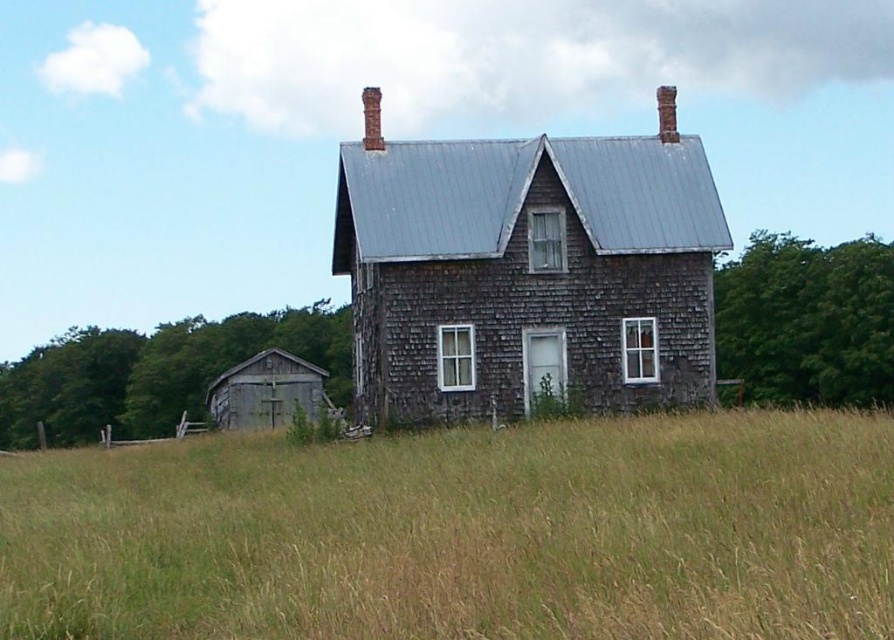
Is point (249, 624) in front of point (597, 394)?

Yes, it is in front of point (597, 394).

Who is lower down, brown grassy field at center or weathered wood barn at center?

brown grassy field at center

This screenshot has width=894, height=640. I want to click on brown grassy field at center, so click(462, 534).

Between brown grassy field at center and weathered wood barn at lower left, which one appears on the right side from the viewer's perspective?

brown grassy field at center

What do you see at coordinates (462, 534) in the screenshot?
I see `brown grassy field at center` at bounding box center [462, 534].

Does point (561, 476) come in front of point (319, 387)?

That is True.

This screenshot has width=894, height=640. Find the location of `brown grassy field at center`. brown grassy field at center is located at coordinates (462, 534).

In the scene shown: Is weathered wood barn at center bigger than weathered wood barn at lower left?

Indeed, weathered wood barn at center has a larger size compared to weathered wood barn at lower left.

Does point (603, 195) come farther from viewer compared to point (283, 397)?

No, it is not.

Who is more forward, (557, 198) or (314, 378)?

Positioned in front is point (557, 198).

Locate an element on the screen. This screenshot has height=640, width=894. weathered wood barn at center is located at coordinates (527, 269).